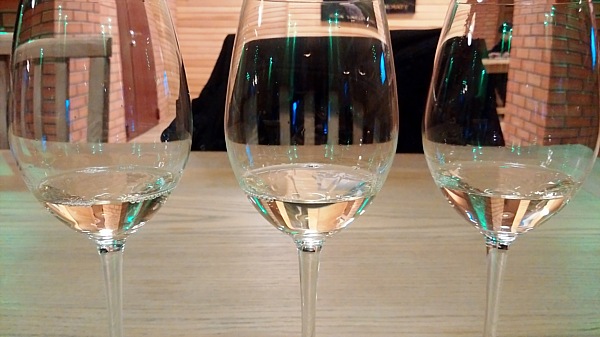
The image size is (600, 337). I want to click on couch, so click(399, 60).